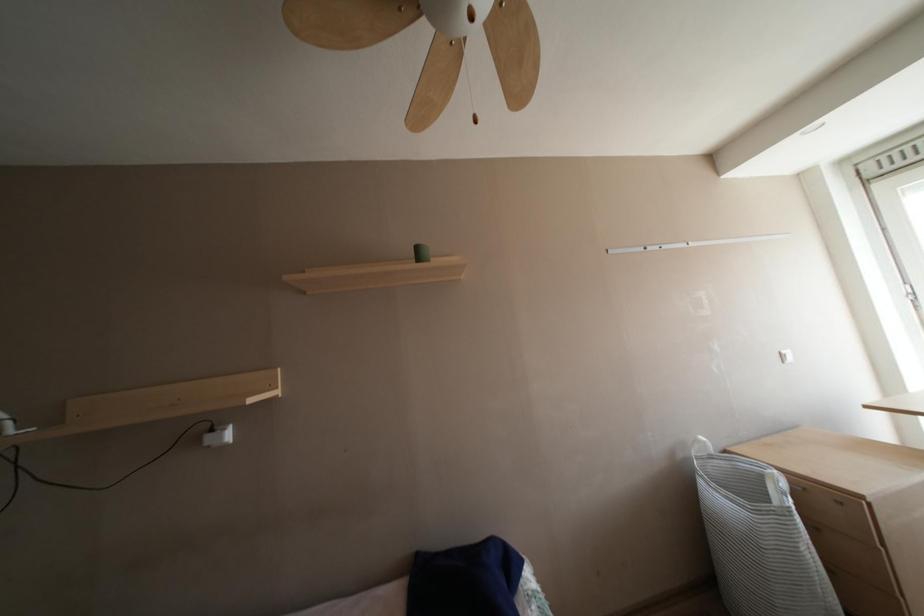
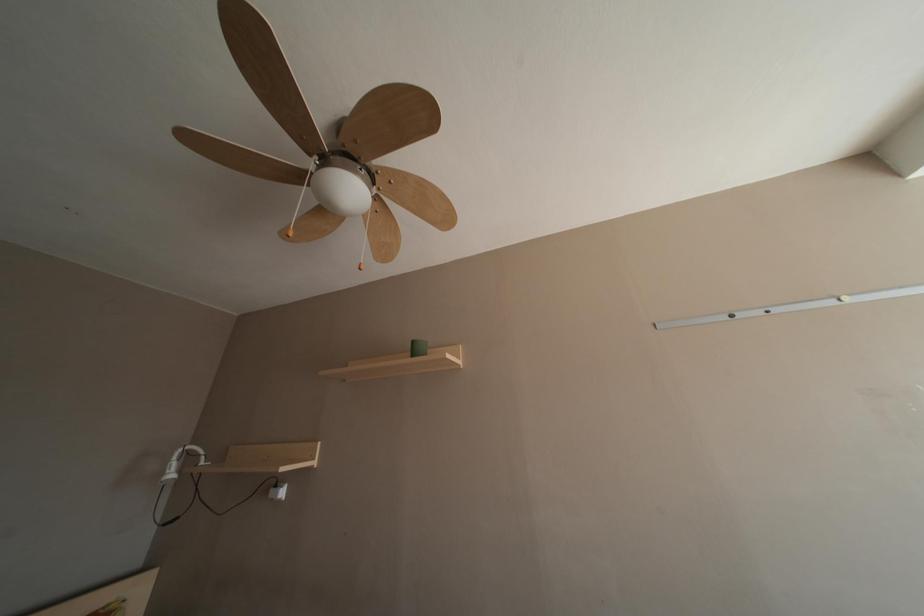
Question: How did the camera likely rotate?

Choices:
 (A) Left
 (B) Right
 (C) Up
 (D) Down

Answer: (A)